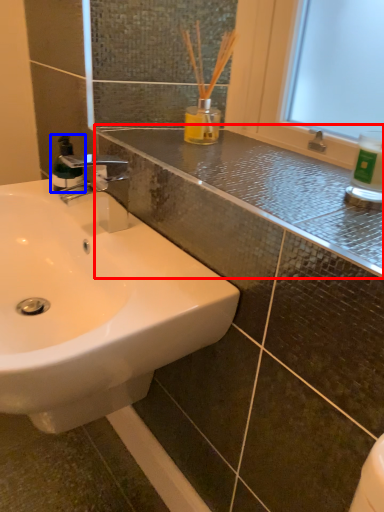
Question: Which point is closer to the camera, counter top (highlighted by a red box) or mouthwash (highlighted by a blue box)?

Choices:
 (A) counter top
 (B) mouthwash

Answer: (A)